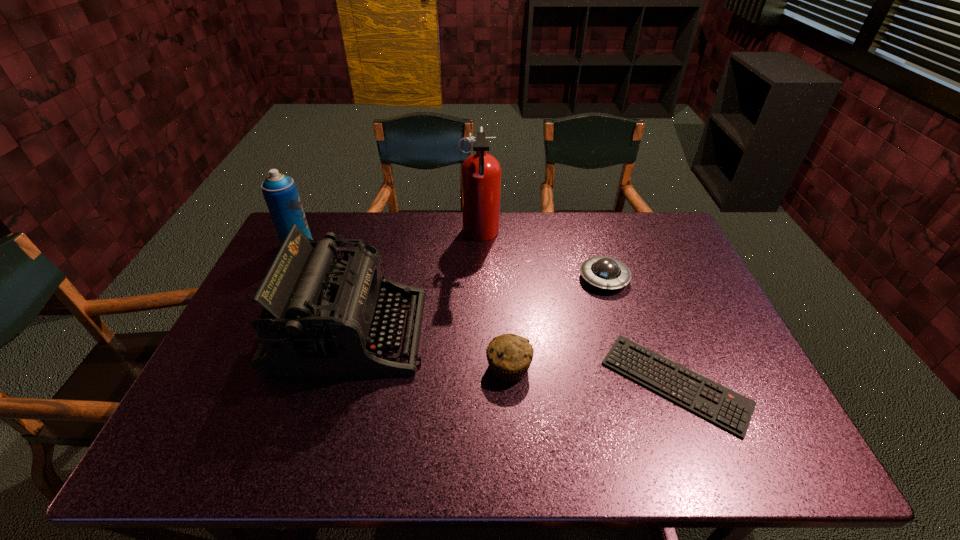
Image resolution: width=960 pixels, height=540 pixels. What are the coordinates of `free space at the far edge of the desktop` in the screenshot? It's located at (x=562, y=245).

In the image, there is a desktop. Where is `vacant space at the near edge`? vacant space at the near edge is located at coordinates (556, 447).

The height and width of the screenshot is (540, 960). In the image, there is a desktop. Find the location of `vacant space at the left edge`. vacant space at the left edge is located at coordinates (247, 352).

This screenshot has height=540, width=960. In the image, there is a desktop. In order to click on free space at the right edge in this screenshot , I will do `click(697, 354)`.

At what (x,y) coordinates should I click in order to perform the action: click on free space between the computer keyboard and the saucer. Please return your answer as a coordinate pair (x, y). Looking at the image, I should click on (639, 331).

Locate an element on the screen. The image size is (960, 540). vacant region between the muffin and the computer keyboard is located at coordinates (592, 375).

Locate an element on the screen. Image resolution: width=960 pixels, height=540 pixels. free area in between the muffin and the second shortest object is located at coordinates (557, 322).

Where is `empty space between the typewriter and the saucer`? This screenshot has width=960, height=540. empty space between the typewriter and the saucer is located at coordinates (477, 305).

Image resolution: width=960 pixels, height=540 pixels. Identify the location of free space between the computer keyboard and the fifth tallest object. (639, 331).

Where is `free space between the tallest object and the muffin`? The image size is (960, 540). free space between the tallest object and the muffin is located at coordinates (494, 301).